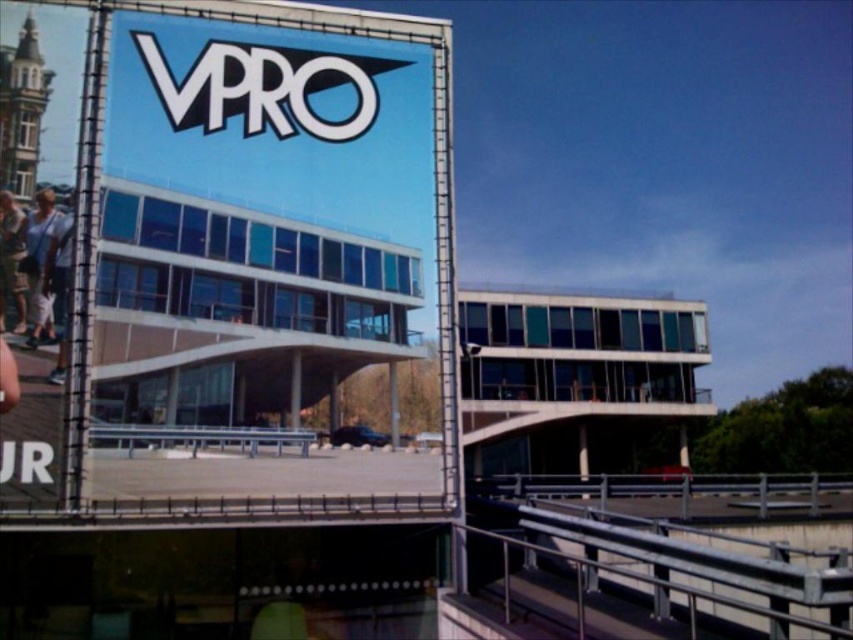
You are a window cleaner working on the building facade. You need to clean the blue glossy sign at upper center and the white glossy sign at upper center. Given that your ladder can extend up to 25 inches, can you reach both signs with a single ladder placement?

The distance between the blue glossy sign at upper center and the white glossy sign at upper center is 25.52 inches. Since your ladder can only extend up to 25 inches, you cannot reach both signs with a single ladder placement as the required distance exceeds the ladder capacity.

You are a delivery person who needs to deliver a package to the building with the VPRO logo. You see the blue glossy sign at upper center and the white glossy sign at upper center. Which sign should you look at to find the correct entrance?

The blue glossy sign at upper center is bigger than the white glossy sign at upper center, so you should look at the blue glossy sign at upper center to find the correct entrance since it is more prominent.

You are standing at the entrance of the modern building with the VPRO logo. You see two points marked on the ground in front of you. The first point is at coordinate point(x=438, y=269) and the second point is at coordinate point(x=358, y=81). Which point is closer to you?

Point(x=438, y=269) is in front of point(x=358, y=81), so the first point is closer to you.